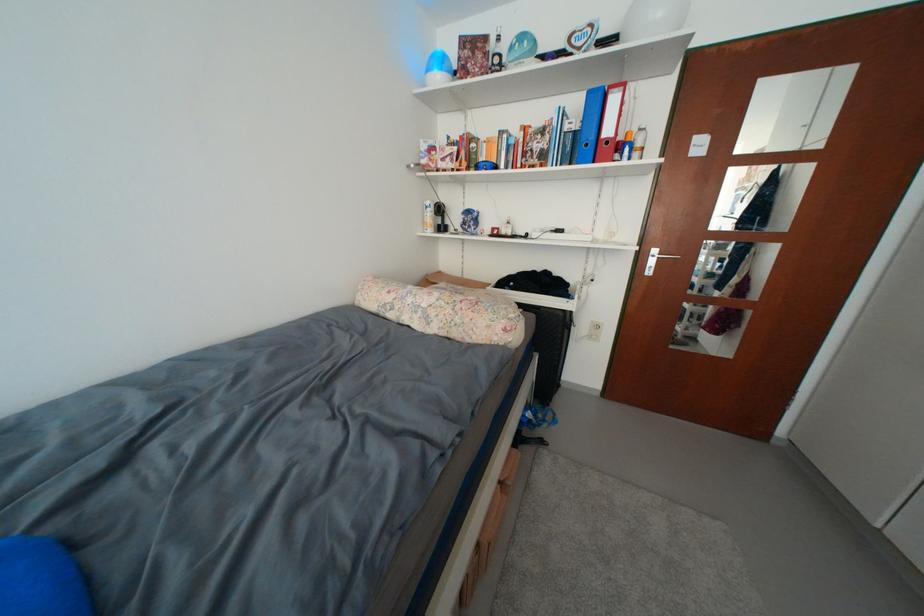
Image resolution: width=924 pixels, height=616 pixels. What are the coordinates of `silver door handle` in the screenshot? It's located at (657, 257).